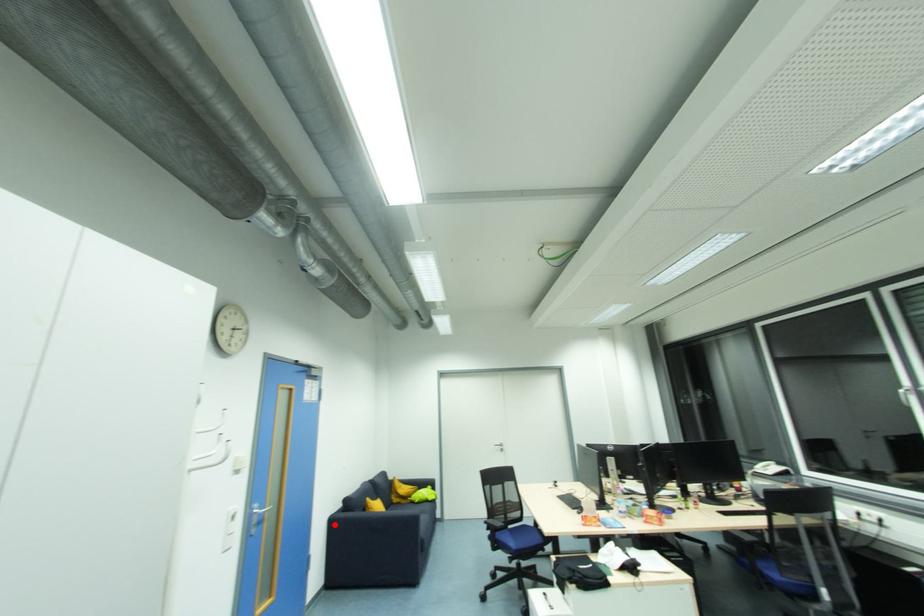
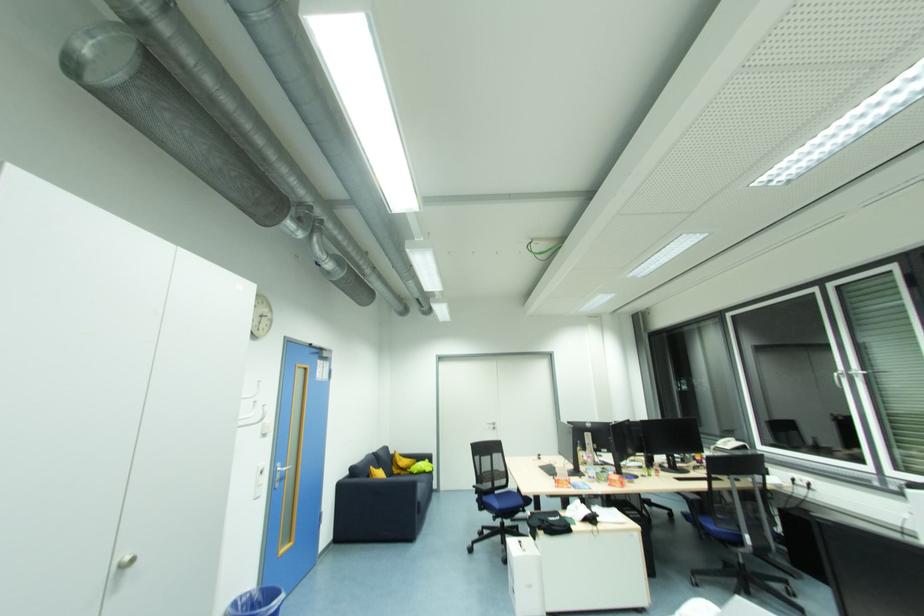
In the second image, find the point that corresponds to the highlighted location in the first image.

(343, 487)